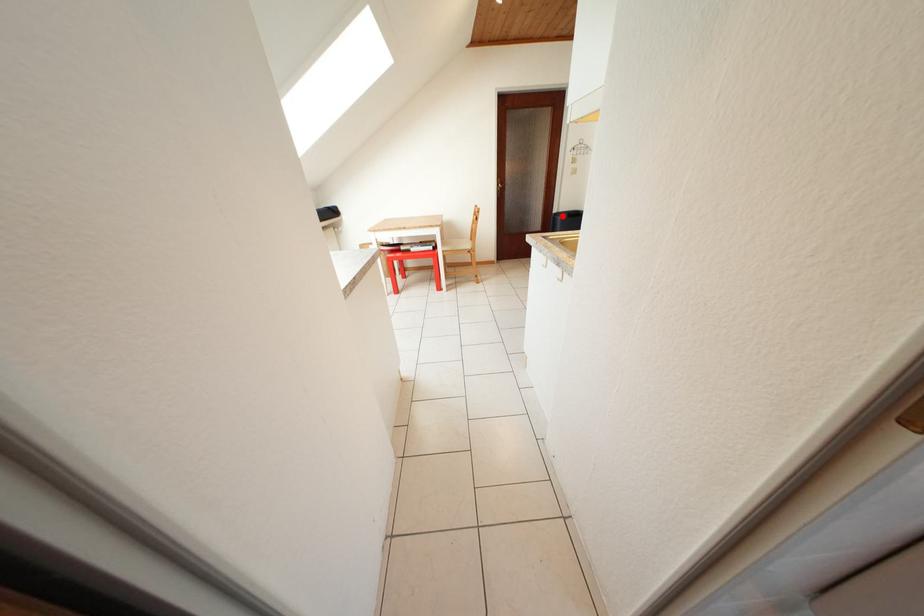
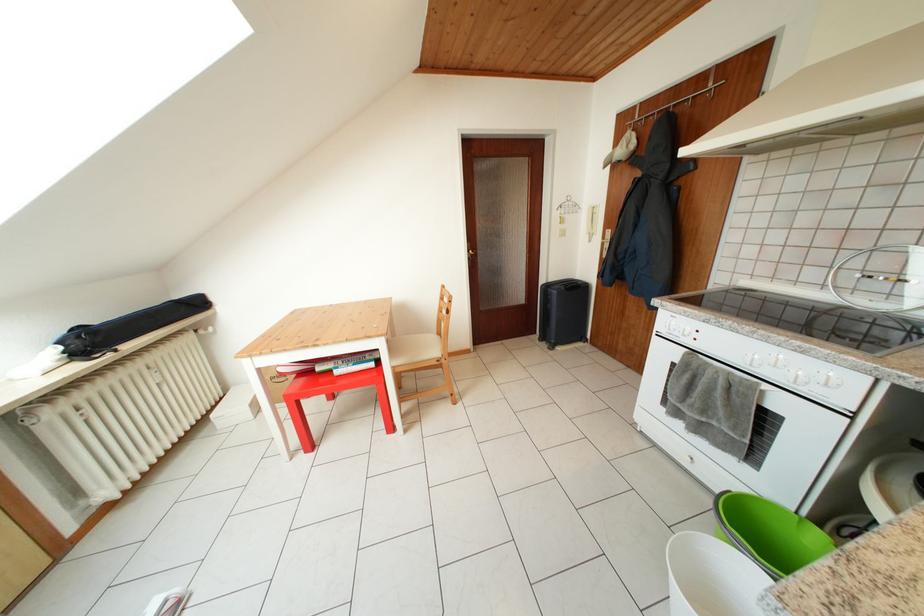
Where in the second image is the point corresponding to the highlighted location from the first image?

(551, 286)